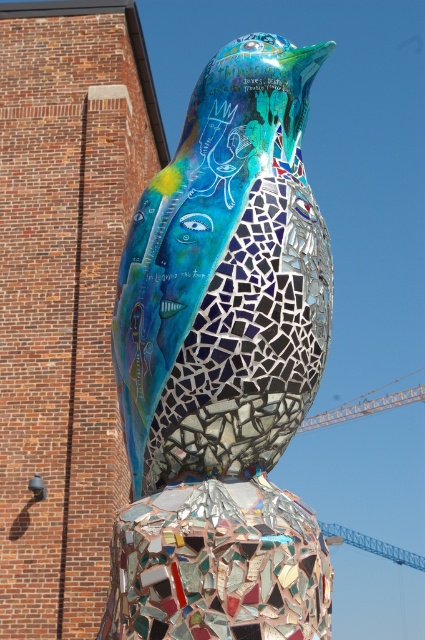
Is mosaic bird at center below metallic orange crane at right?

No, mosaic bird at center is not below metallic orange crane at right.

Which is behind, point (277, 77) or point (309, 420)?

Point (309, 420)

Where is `mosaic bird at center`? Image resolution: width=425 pixels, height=640 pixels. mosaic bird at center is located at coordinates 223,364.